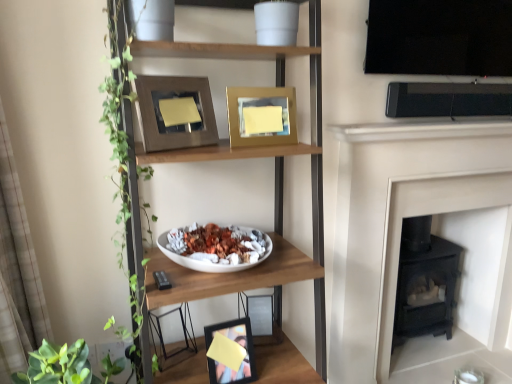
Question: Does matte black picture frame at lower center, which is the 1th picture frame from bottom to top, have a lesser width compared to black matte fireplace at right?

Choices:
 (A) yes
 (B) no

Answer: (B)

Question: Is matte black picture frame at lower center, which is the fourth picture frame in top-to-bottom order, next to black matte fireplace at right and touching it?

Choices:
 (A) no
 (B) yes

Answer: (A)

Question: Does matte black picture frame at lower center, which is the fourth picture frame in top-to-bottom order, have a greater height compared to black matte fireplace at right?

Choices:
 (A) no
 (B) yes

Answer: (A)

Question: From a real-world perspective, is matte black picture frame at lower center, which is the fourth picture frame in top-to-bottom order, under black matte fireplace at right?

Choices:
 (A) yes
 (B) no

Answer: (A)

Question: Considering the relative positions of matte black picture frame at lower center, which is the 1th picture frame from bottom to top, and black matte fireplace at right in the image provided, is matte black picture frame at lower center, which is the 1th picture frame from bottom to top, to the right of black matte fireplace at right from the viewer's perspective?

Choices:
 (A) no
 (B) yes

Answer: (A)

Question: From the image's perspective, relative to wooden frame at upper center, the 1th picture frame positioned from the top, is gold metallic picture frame at upper center, acting as the third picture frame starting from the bottom, above or below?

Choices:
 (A) above
 (B) below

Answer: (B)

Question: Considering the positions of point (245, 117) and point (170, 142), is point (245, 117) closer or farther from the camera than point (170, 142)?

Choices:
 (A) farther
 (B) closer

Answer: (A)

Question: From a real-world perspective, is gold metallic picture frame at upper center, which is the 2th picture frame from top to bottom, physically located above or below wooden frame at upper center, which ranks as the 4th picture frame in bottom-to-top order?

Choices:
 (A) below
 (B) above

Answer: (A)

Question: In the image, is gold metallic picture frame at upper center, which is the 2th picture frame from top to bottom, on the left side or the right side of wooden frame at upper center, the 1th picture frame positioned from the top?

Choices:
 (A) left
 (B) right

Answer: (B)

Question: From their relative heights in the image, would you say black matte fireplace at right is taller or shorter than gold metallic picture frame at upper center, which is the 2th picture frame from top to bottom?

Choices:
 (A) short
 (B) tall

Answer: (B)

Question: From a real-world perspective, is black matte fireplace at right positioned above or below gold metallic picture frame at upper center, which is the 2th picture frame from top to bottom?

Choices:
 (A) above
 (B) below

Answer: (B)

Question: Is black matte fireplace at right in front of or behind gold metallic picture frame at upper center, which is the 2th picture frame from top to bottom, in the image?

Choices:
 (A) front
 (B) behind

Answer: (B)

Question: Does point (406, 177) appear closer or farther from the camera than point (245, 137)?

Choices:
 (A) closer
 (B) farther

Answer: (B)

Question: From the image's perspective, relative to matte black picture frame at lower center, which is the fourth picture frame in top-to-bottom order, is metallic silver photo frame at lower center, the 2th picture frame positioned from the bottom, above or below?

Choices:
 (A) below
 (B) above

Answer: (B)

Question: Considering the positions of metallic silver photo frame at lower center, the 2th picture frame positioned from the bottom, and matte black picture frame at lower center, which is the fourth picture frame in top-to-bottom order, in the image, is metallic silver photo frame at lower center, the 2th picture frame positioned from the bottom, bigger or smaller than matte black picture frame at lower center, which is the fourth picture frame in top-to-bottom order,?

Choices:
 (A) small
 (B) big

Answer: (A)